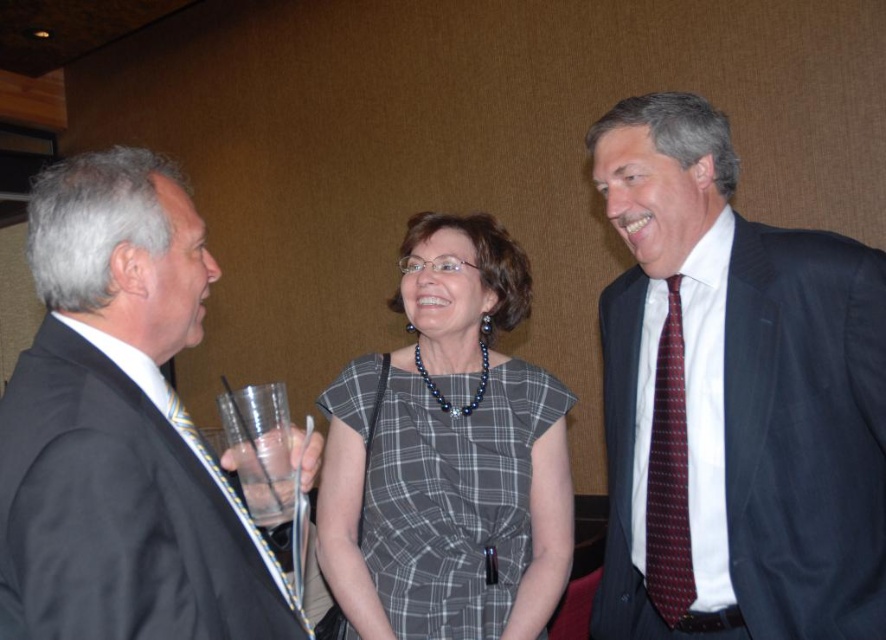
You are at a formal event and need to know the distance between the dark blue suit at right and the matte black suit at left to decide if you can safely walk between them. The path between them is 30 inches wide. Can you pass through?

The dark blue suit at right is 28.05 inches from the matte black suit at left. Since the path between them is narrower than 30 inches, you cannot safely walk between them.

You are a photographer setting up for a group photo. You need to arrange the matte black suit at left and the plaid fabric dress at center so that both subjects are visible in the frame. Based on their widths, which subject should be placed closer to the camera to ensure both fit in the photo?

The matte black suit at left is thinner than the plaid fabric dress at center. To ensure both fit in the photo, the plaid fabric dress at center should be placed closer to the camera since wider objects appear larger and might require more space when positioned further back.

You are standing at the origin point in the image. Which of the two points, point (x=833, y=269) or point (x=25, y=604), is farther away from you?

Point (x=833, y=269) is farther away from you than point (x=25, y=604).